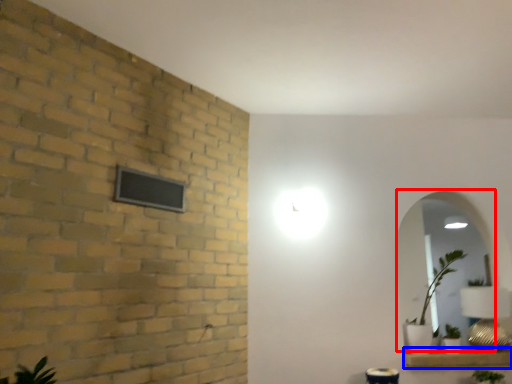
Question: Which object appears closest to the camera in this image, mirror (highlighted by a red box) or window sill (highlighted by a blue box)?

Choices:
 (A) mirror
 (B) window sill

Answer: (B)